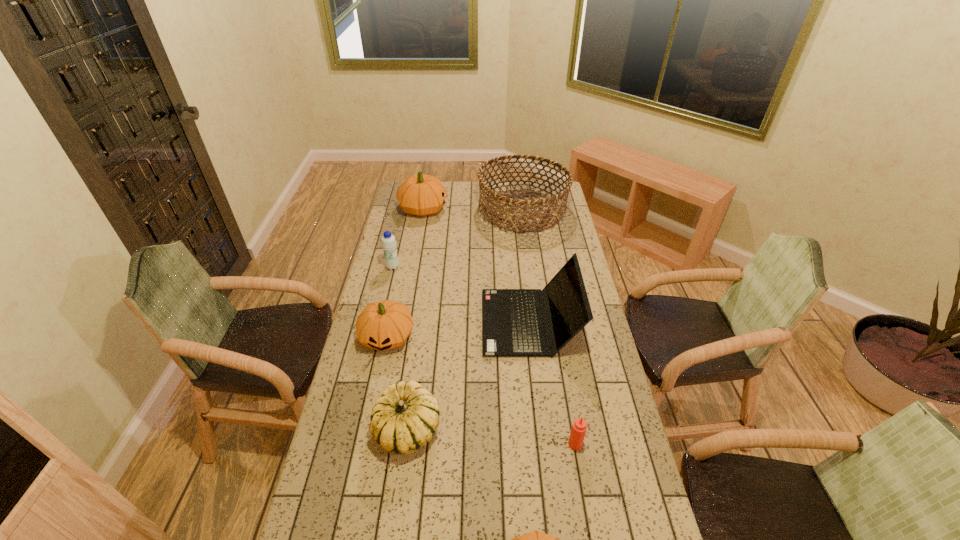
The height and width of the screenshot is (540, 960). In order to click on unoccupied area between the basket and the water bottle in this screenshot , I will do `click(458, 239)`.

Find the location of a particular element. The image size is (960, 540). free point between the farthest gourd and the basket is located at coordinates (473, 210).

Where is `vacant region between the second farthest gourd and the black laptop computer`? vacant region between the second farthest gourd and the black laptop computer is located at coordinates (458, 329).

Locate an element on the screen. The width and height of the screenshot is (960, 540). object that is the fifth closest one to the basket is located at coordinates (405, 418).

Identify which object is the fifth nearest to the blue water bottle. Please provide its 2D coordinates. Your answer should be formatted as a tuple, i.e. [(x, y)], where the tuple contains the x and y coordinates of a point satisfying the conditions above.

[(405, 418)]

Where is `the second closest gourd to the black laptop computer`? the second closest gourd to the black laptop computer is located at coordinates tap(383, 325).

Choose which gourd is the nearest neighbor to the shortest gourd. Please provide its 2D coordinates. Your answer should be formatted as a tuple, i.e. [(x, y)], where the tuple contains the x and y coordinates of a point satisfying the conditions above.

[(405, 418)]

Locate an element on the screen. orange gourd that is the closest to the black laptop computer is located at coordinates (383, 325).

The width and height of the screenshot is (960, 540). In order to click on orange gourd that is the second nearest to the basket in this screenshot , I will do `click(383, 325)`.

You are a GUI agent. You are given a task and a screenshot of the screen. Output one action in this format:
    pyautogui.click(x=<x>, y=<y>)
    Task: Click on the free location that satisfies the following two spatial constraints: 1. on the screen of the laptop computer; 2. on the side of the second farthest gourd with the carved face
    
    Given the screenshot: What is the action you would take?
    pyautogui.click(x=531, y=336)